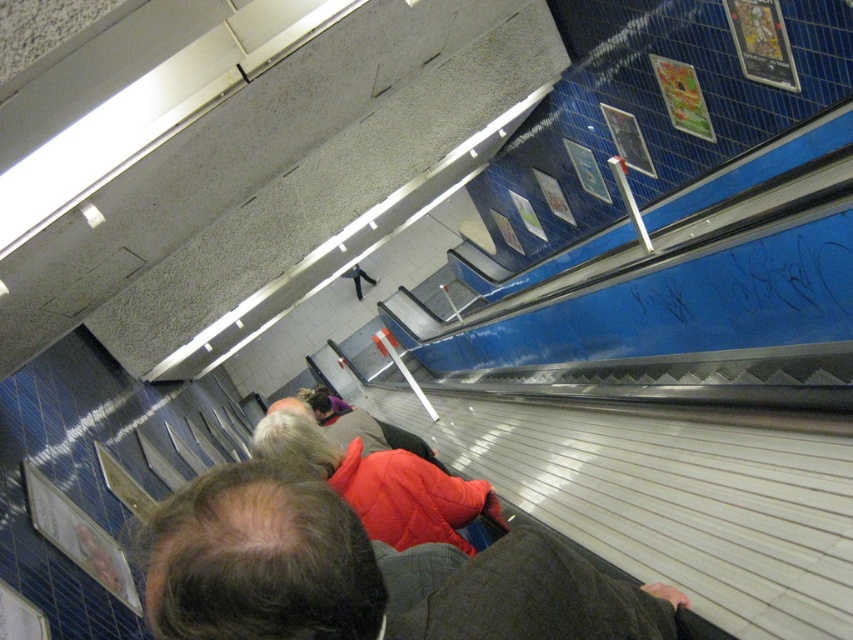
Question: Can you confirm if red quilted jacket at center is positioned to the right of red puffy coat at center?

Choices:
 (A) yes
 (B) no

Answer: (A)

Question: Which point appears closest to the camera in this image?

Choices:
 (A) (364, 492)
 (B) (173, 588)

Answer: (B)

Question: Where is red quilted jacket at center located in relation to red puffy coat at center in the image?

Choices:
 (A) above
 (B) below

Answer: (A)

Question: Which object appears closest to the camera in this image?

Choices:
 (A) red puffy coat at center
 (B) red quilted jacket at center

Answer: (B)

Question: Is the position of red quilted jacket at center more distant than that of red puffy coat at center?

Choices:
 (A) yes
 (B) no

Answer: (B)

Question: Which point is closer to the camera?

Choices:
 (A) (440, 628)
 (B) (289, 419)

Answer: (A)